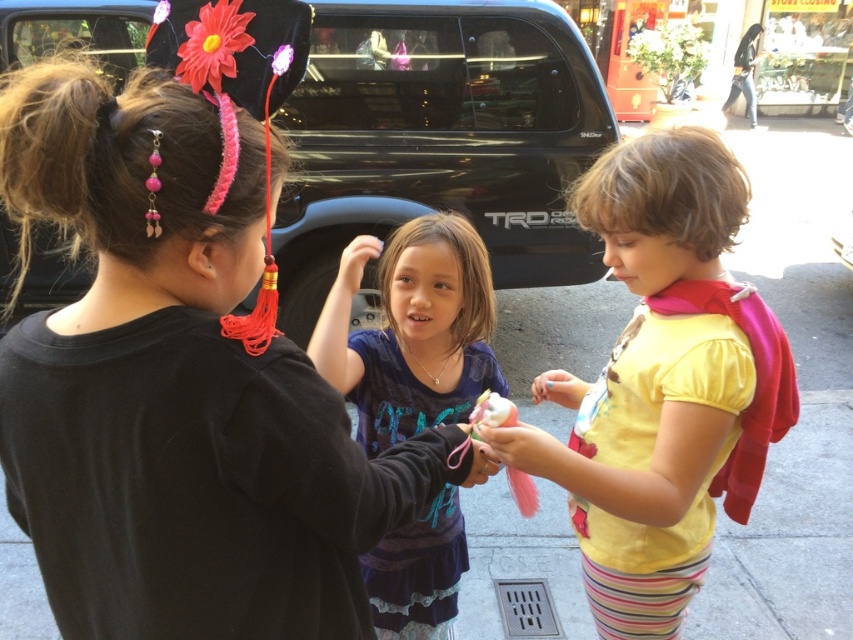
You are a photographer trying to capture a photo of the yellow cotton shirt at center and the purple cotton shirt at center. Since you want to focus on both shirts, which one should you adjust your camera angle to look up at or down at?

The yellow cotton shirt at center is located above the purple cotton shirt at center, so you should adjust your camera angle to look down at the yellow cotton shirt at center and up at the purple cotton shirt at center to focus on both shirts.